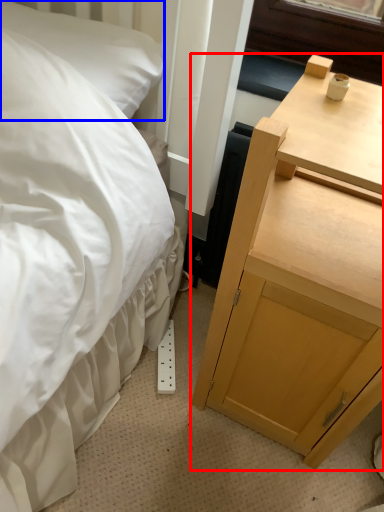
Question: Which object appears farthest to the camera in this image, nightstand (highlighted by a red box) or pillow (highlighted by a blue box)?

Choices:
 (A) nightstand
 (B) pillow

Answer: (B)